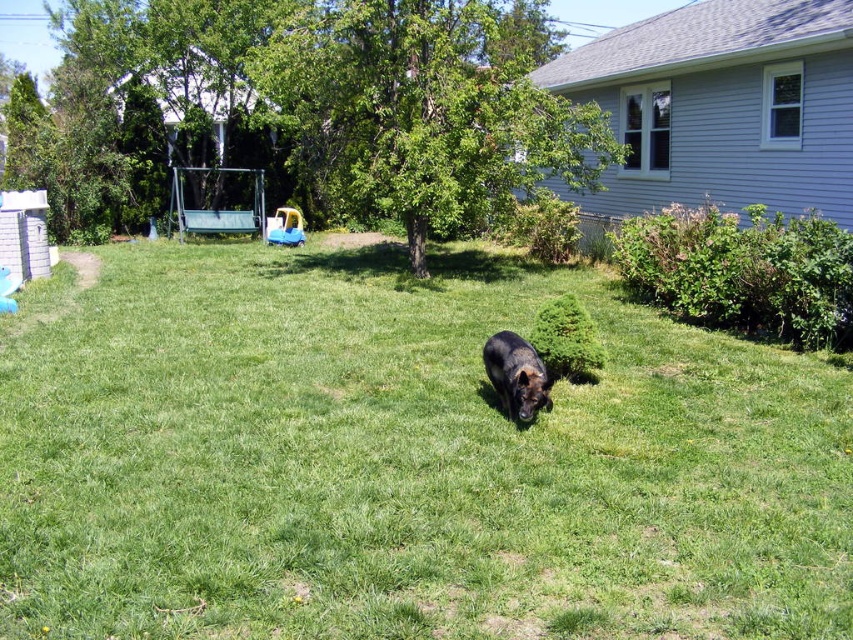
You are planning to place a small garden bench in the backyard. The bench requires a space wider than the black fur dog at center. Can the green grassy at center provide enough width for the bench?

The green grassy at center has a greater width than the black fur dog at center, so yes, the green grassy at center can provide enough width for the bench.

You are standing in the backyard and want to throw a ball to the point marked at coordinates point (283, 268). If your throwing range is up to 15 meters, can you reach that point?

The point (283, 268) is 14.72 meters away from the viewer, which is within your throwing range of up to 15 meters. Yes, you can reach that point.

You are planning to set up a small tent in the backyard. The tent requires an area larger than the black fur dog at center. Can the green grassy at center accommodate the tent?

The green grassy at center is larger in size than the black fur dog at center, so yes, the green grassy at center can accommodate the tent since it has enough space.